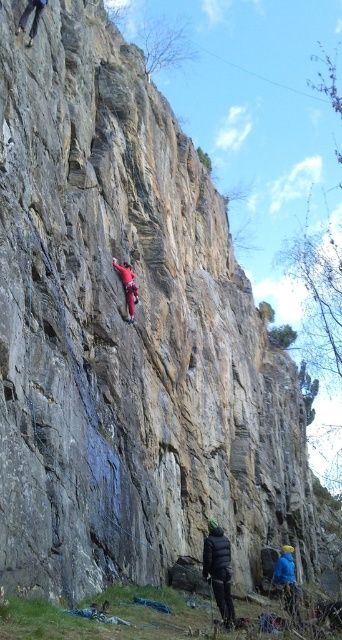
Is black puffy jacket at lower center behind red climbing suit at center?

That is False.

The image size is (342, 640). In order to click on black puffy jacket at lower center in this screenshot , I will do (218, 570).

The width and height of the screenshot is (342, 640). I want to click on black puffy jacket at lower center, so click(218, 570).